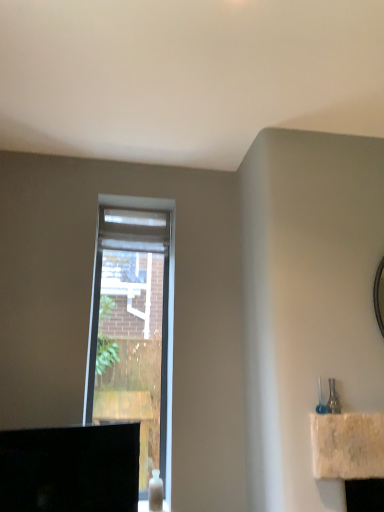
Question: From the image's perspective, is white sheer curtain at center located beneath clear glass window at center?

Choices:
 (A) no
 (B) yes

Answer: (A)

Question: Can you confirm if white sheer curtain at center is taller than clear glass window at center?

Choices:
 (A) no
 (B) yes

Answer: (A)

Question: Considering the relative positions of white sheer curtain at center and clear glass window at center in the image provided, is white sheer curtain at center in front of clear glass window at center?

Choices:
 (A) no
 (B) yes

Answer: (A)

Question: Considering the relative sizes of white sheer curtain at center and clear glass window at center in the image provided, is white sheer curtain at center thinner than clear glass window at center?

Choices:
 (A) yes
 (B) no

Answer: (B)

Question: From a real-world perspective, is white sheer curtain at center physically above clear glass window at center?

Choices:
 (A) no
 (B) yes

Answer: (B)

Question: Can you see white sheer curtain at center touching clear glass window at center?

Choices:
 (A) no
 (B) yes

Answer: (A)

Question: Is clear glass window at center shorter than white sheer curtain at center?

Choices:
 (A) yes
 (B) no

Answer: (B)

Question: Is clear glass window at center not near white sheer curtain at center?

Choices:
 (A) no
 (B) yes

Answer: (A)

Question: Does clear glass window at center have a larger size compared to white sheer curtain at center?

Choices:
 (A) no
 (B) yes

Answer: (B)

Question: Considering the relative sizes of clear glass window at center and white sheer curtain at center in the image provided, is clear glass window at center smaller than white sheer curtain at center?

Choices:
 (A) yes
 (B) no

Answer: (B)

Question: Is white sheer curtain at center completely or partially inside clear glass window at center?

Choices:
 (A) yes
 (B) no

Answer: (B)

Question: Is clear glass window at center positioned before white sheer curtain at center?

Choices:
 (A) yes
 (B) no

Answer: (A)

Question: Is point (135, 244) closer or farther from the camera than point (152, 365)?

Choices:
 (A) closer
 (B) farther

Answer: (B)